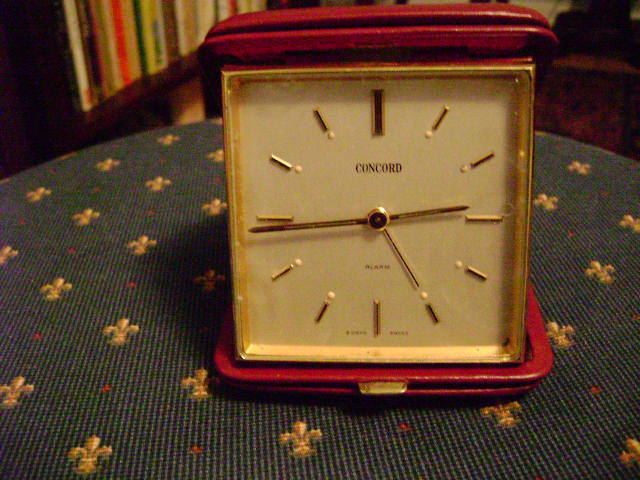
The width and height of the screenshot is (640, 480). I want to click on time piece, so click(x=312, y=194).